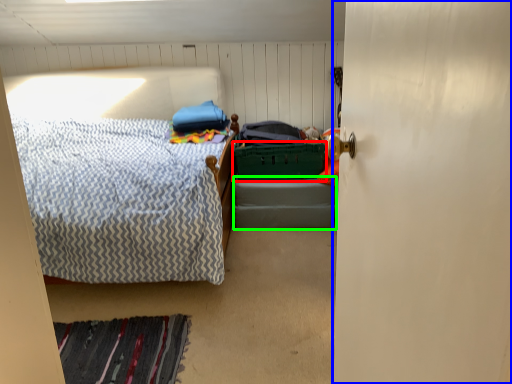
Question: Estimate the real-world distances between objects in this image. Which object is farther from laundry basket (highlighted by a red box), door (highlighted by a blue box) or bed frame (highlighted by a green box)?

Choices:
 (A) door
 (B) bed frame

Answer: (A)